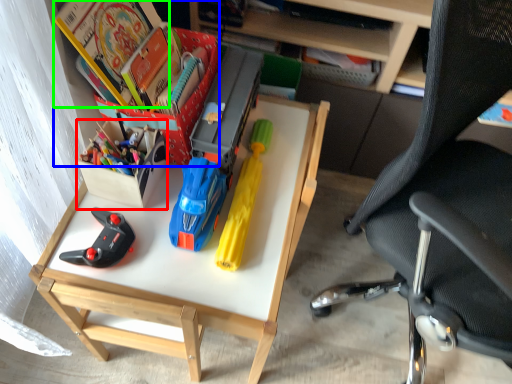
Question: Which object is the farthest from kit (highlighted by a red box)? Choose among these: book (highlighted by a blue box) or book (highlighted by a green box).

Choices:
 (A) book
 (B) book

Answer: (B)